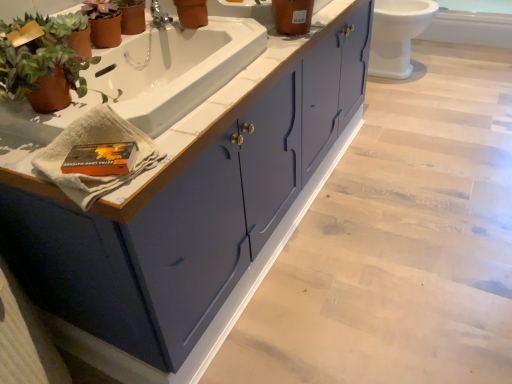
Question: Considering the relative sizes of silver metallic faucet at upper center and white glossy toilet at upper right in the image provided, is silver metallic faucet at upper center shorter than white glossy toilet at upper right?

Choices:
 (A) yes
 (B) no

Answer: (A)

Question: Is silver metallic faucet at upper center smaller than white glossy toilet at upper right?

Choices:
 (A) yes
 (B) no

Answer: (A)

Question: Does silver metallic faucet at upper center have a greater height compared to white glossy toilet at upper right?

Choices:
 (A) yes
 (B) no

Answer: (B)

Question: Can you confirm if silver metallic faucet at upper center is positioned to the left of white glossy toilet at upper right?

Choices:
 (A) no
 (B) yes

Answer: (B)

Question: Would you say silver metallic faucet at upper center is outside white glossy toilet at upper right?

Choices:
 (A) no
 (B) yes

Answer: (B)

Question: From a real-world perspective, is silver metallic faucet at upper center beneath white glossy toilet at upper right?

Choices:
 (A) no
 (B) yes

Answer: (A)

Question: Does white glossy toilet at upper right have a lesser width compared to terracotta clay pot at left?

Choices:
 (A) yes
 (B) no

Answer: (B)

Question: Is white glossy toilet at upper right behind terracotta clay pot at left?

Choices:
 (A) no
 (B) yes

Answer: (B)

Question: Considering the relative sizes of white glossy toilet at upper right and terracotta clay pot at left in the image provided, is white glossy toilet at upper right bigger than terracotta clay pot at left?

Choices:
 (A) no
 (B) yes

Answer: (B)

Question: Is the surface of white glossy toilet at upper right in direct contact with terracotta clay pot at left?

Choices:
 (A) yes
 (B) no

Answer: (B)

Question: Does white glossy toilet at upper right have a smaller size compared to terracotta clay pot at left?

Choices:
 (A) yes
 (B) no

Answer: (B)

Question: From a real-world perspective, is white glossy toilet at upper right under terracotta clay pot at left?

Choices:
 (A) yes
 (B) no

Answer: (A)

Question: Are white glossy toilet at upper right and matte orange pot at upper center located far from each other?

Choices:
 (A) no
 (B) yes

Answer: (B)